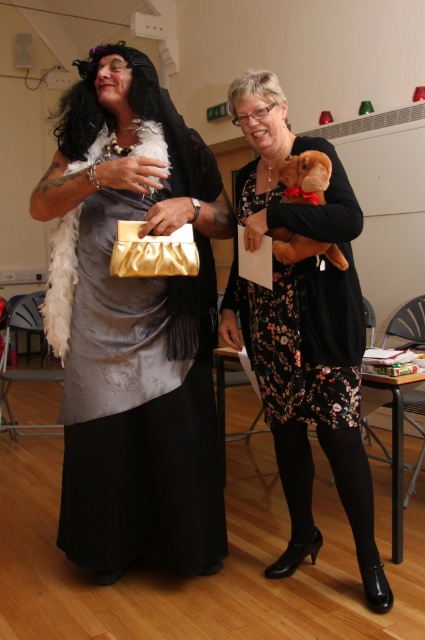
Can you confirm if satin gold clutch at center is positioned to the left of brown plush toy at center?

Correct, you'll find satin gold clutch at center to the left of brown plush toy at center.

Who is more forward, (180, 115) or (316, 243)?

Positioned in front is point (316, 243).

Is point (172, 154) less distant than point (314, 180)?

No, (172, 154) is further to viewer.

Image resolution: width=425 pixels, height=640 pixels. Find the location of `satin gold clutch at center`. satin gold clutch at center is located at coordinates (133, 324).

Can you confirm if satin gold clutch at center is smaller than floral fabric dress at center?

No, satin gold clutch at center is not smaller than floral fabric dress at center.

Can you confirm if satin gold clutch at center is positioned to the left of floral fabric dress at center?

Correct, you'll find satin gold clutch at center to the left of floral fabric dress at center.

Is point (184, 173) positioned behind point (277, 195)?

Yes, it is.

Where is `satin gold clutch at center`? satin gold clutch at center is located at coordinates (133, 324).

Between floral fabric dress at center and brown plush toy at center, which one appears on the left side from the viewer's perspective?

Positioned to the left is floral fabric dress at center.

Is point (326, 410) in front of point (320, 163)?

No, it is behind (320, 163).

Which is behind, point (295, 387) or point (322, 253)?

Point (295, 387)

Where is `floral fabric dress at center`? This screenshot has height=640, width=425. floral fabric dress at center is located at coordinates (303, 304).